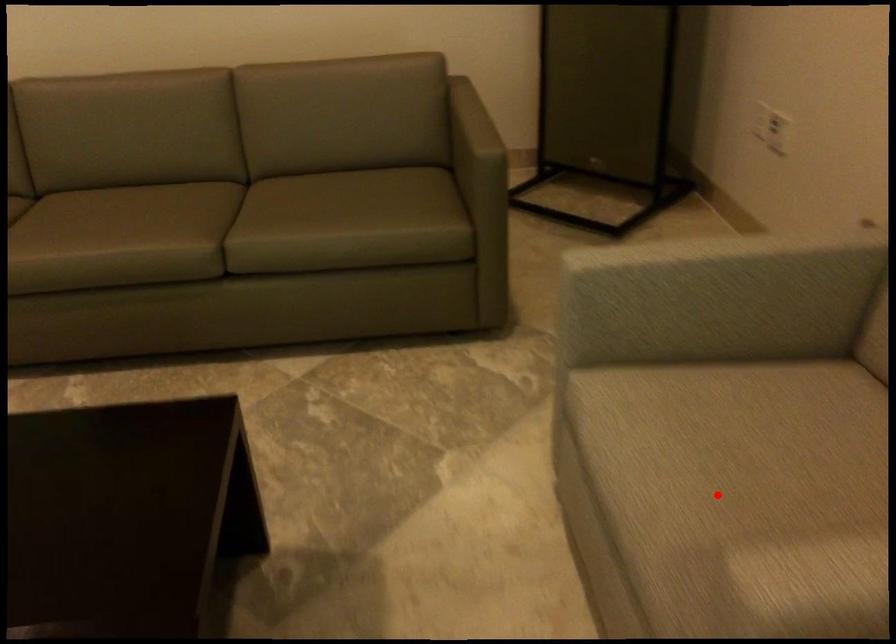
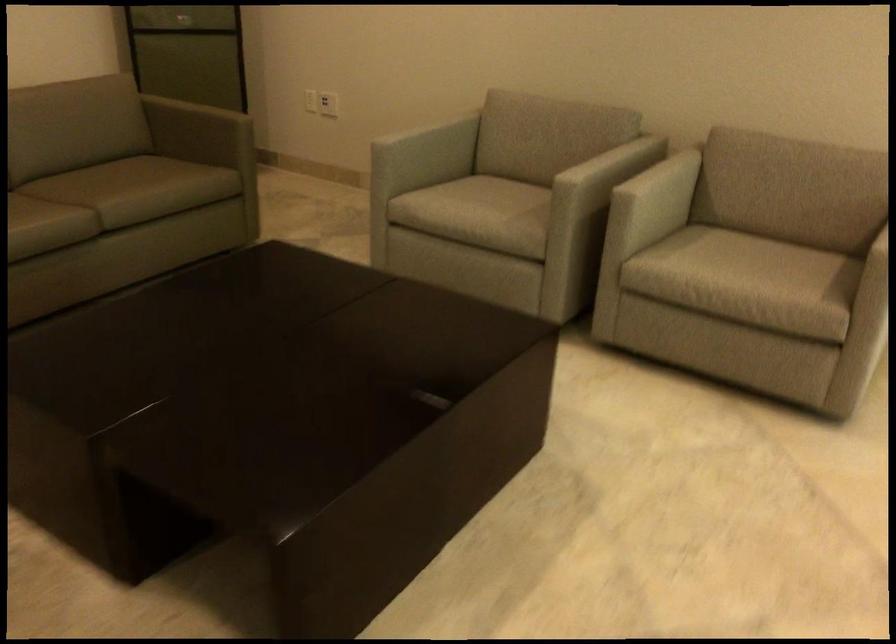
Where in the second image is the point corresponding to the highlighted location from the first image?

(480, 207)